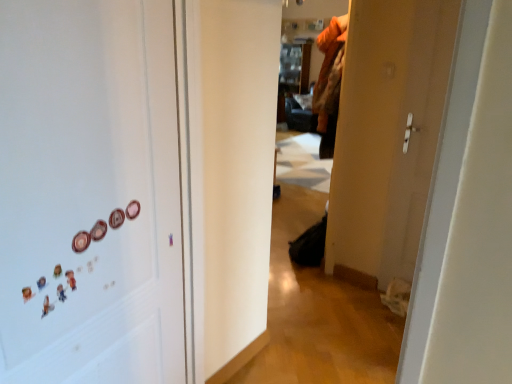
Question: Does point (90, 238) appear closer or farther from the camera than point (39, 1)?

Choices:
 (A) farther
 (B) closer

Answer: (A)

Question: In the image, is pink glossy button at left, which is the 1th button in left-to-right order, on the left side or the right side of white matte magnets at left?

Choices:
 (A) left
 (B) right

Answer: (A)

Question: Estimate the real-world distances between objects in this image. Which object is closer to the pink glossy button at left, the first button when ordered from front to back?

Choices:
 (A) white matte magnets at left
 (B) matte plastic button at left, which is the 2th button in front-to-back order

Answer: (B)

Question: Considering the real-world distances, which object is closest to the white matte magnets at left?

Choices:
 (A) pink glossy button at left, the first button when ordered from front to back
 (B) matte plastic button at left, which is the first button in back-to-front order

Answer: (B)